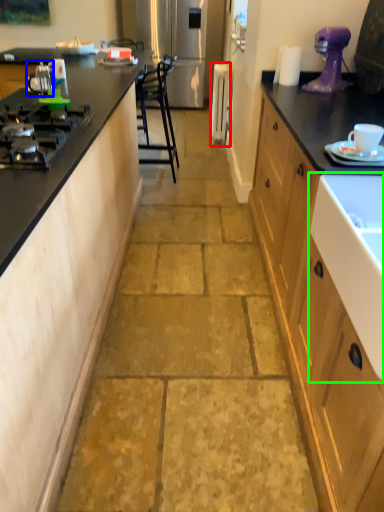
Question: Based on their relative distances, which object is farther from appliance (highlighted by a red box)? Choose from appliance (highlighted by a blue box) and sink (highlighted by a green box).

Choices:
 (A) appliance
 (B) sink

Answer: (B)